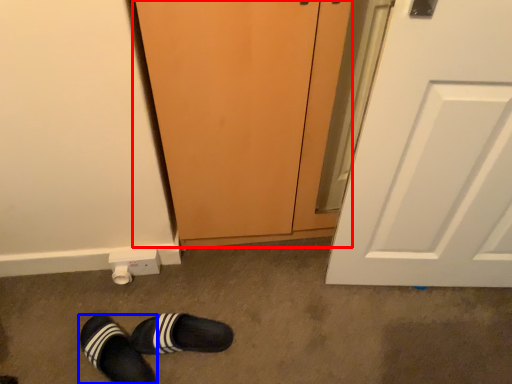
Question: Among these objects, which one is farthest to the camera, screen door (highlighted by a red box) or footwear (highlighted by a blue box)?

Choices:
 (A) screen door
 (B) footwear

Answer: (B)